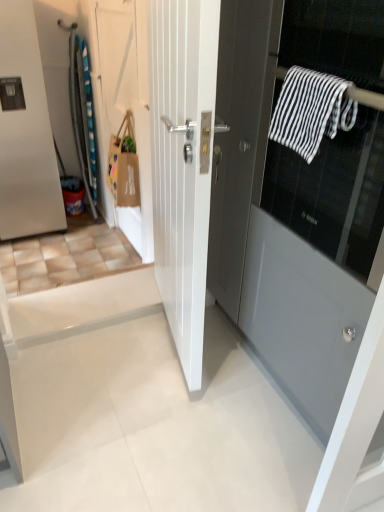
The width and height of the screenshot is (384, 512). Describe the element at coordinates (317, 214) in the screenshot. I see `matte gray door at center, the 4th door positioned from the left` at that location.

Image resolution: width=384 pixels, height=512 pixels. What do you see at coordinates (127, 102) in the screenshot?
I see `white matte door at upper left, placed as the 2th door when sorted from left to right` at bounding box center [127, 102].

This screenshot has height=512, width=384. What do you see at coordinates (311, 111) in the screenshot?
I see `black and white striped towel at upper right` at bounding box center [311, 111].

Measure the distance between point [208,206] and camera.

The depth of point [208,206] is 5.62 feet.

You are a GUI agent. You are given a task and a screenshot of the screen. Output one action in this format:
    pyautogui.click(x=<x>, y=<y>)
    Task: Click on the white glossy door at center, placed as the second door when sorted from right to left
    
    Given the screenshot: What is the action you would take?
    pyautogui.click(x=183, y=163)

This screenshot has width=384, height=512. Describe the element at coordinates (123, 167) in the screenshot. I see `brown paper bag at upper left` at that location.

Where is `satin silver refrigerator at left, which is the 4th door from right to left`? satin silver refrigerator at left, which is the 4th door from right to left is located at coordinates (26, 134).

Where is `matte gray door at center, the 4th door positioned from the left`? The height and width of the screenshot is (512, 384). matte gray door at center, the 4th door positioned from the left is located at coordinates (317, 214).

Could you tell me if matte gray door at center, which is the first door in right-to-left order, is facing white matte door at upper left, placed as the 2th door when sorted from left to right?

No, matte gray door at center, which is the first door in right-to-left order, is not aimed at white matte door at upper left, placed as the 2th door when sorted from left to right.

From a real-world perspective, is matte gray door at center, the 4th door positioned from the left, located higher than white matte door at upper left, placed as the 2th door when sorted from left to right?

Indeed, from a real-world perspective, matte gray door at center, the 4th door positioned from the left, stands above white matte door at upper left, placed as the 2th door when sorted from left to right.

Which object is closer to the camera taking this photo, matte gray door at center, which is the first door in right-to-left order, or white matte door at upper left, which appears as the 3th door when viewed from the right?

matte gray door at center, which is the first door in right-to-left order, is closer to the camera.

Can you confirm if matte gray door at center, the 4th door positioned from the left, is thinner than white matte door at upper left, which appears as the 3th door when viewed from the right?

No.

Is white glossy door at center, the 3th door from the left, thinner than black and white striped towel at upper right?

In fact, white glossy door at center, the 3th door from the left, might be wider than black and white striped towel at upper right.

From the image's perspective, which one is positioned higher, white glossy door at center, the 3th door from the left, or black and white striped towel at upper right?

black and white striped towel at upper right is shown above in the image.

Considering the relative positions of white glossy door at center, the 3th door from the left, and black and white striped towel at upper right in the image provided, is white glossy door at center, the 3th door from the left, to the left of black and white striped towel at upper right from the viewer's perspective?

Indeed, white glossy door at center, the 3th door from the left, is positioned on the left side of black and white striped towel at upper right.

Which is farther from the camera, (361, 109) or (125, 164)?

The point (125, 164) is farther from the camera.

Could you tell me if matte gray door at center, the 4th door positioned from the left, is facing brown paper bag at upper left?

No, matte gray door at center, the 4th door positioned from the left, is not aimed at brown paper bag at upper left.

Considering the relative sizes of matte gray door at center, which is the first door in right-to-left order, and brown paper bag at upper left in the image provided, is matte gray door at center, which is the first door in right-to-left order, taller than brown paper bag at upper left?

Indeed, matte gray door at center, which is the first door in right-to-left order, has a greater height compared to brown paper bag at upper left.

Measure the distance from matte gray door at center, the 4th door positioned from the left, to brown paper bag at upper left.

matte gray door at center, the 4th door positioned from the left, is 1.60 meters away from brown paper bag at upper left.

Does white glossy door at center, placed as the second door when sorted from right to left, have a greater width compared to brown paper bag at upper left?

Incorrect, the width of white glossy door at center, placed as the second door when sorted from right to left, does not surpass that of brown paper bag at upper left.

Considering the relative positions of white glossy door at center, the 3th door from the left, and brown paper bag at upper left in the image provided, is white glossy door at center, the 3th door from the left, to the right of brown paper bag at upper left from the viewer's perspective?

Correct, you'll find white glossy door at center, the 3th door from the left, to the right of brown paper bag at upper left.

From the image's perspective, which one is positioned lower, white glossy door at center, placed as the second door when sorted from right to left, or brown paper bag at upper left?

white glossy door at center, placed as the second door when sorted from right to left, is shown below in the image.

Based on the photo, would you say satin silver refrigerator at left, the first door when ordered from left to right, is inside or outside brown paper bag at upper left?

satin silver refrigerator at left, the first door when ordered from left to right, is located beyond the bounds of brown paper bag at upper left.

From a real-world perspective, is satin silver refrigerator at left, which is the 4th door from right to left, physically located above or below brown paper bag at upper left?

From a real-world perspective, satin silver refrigerator at left, which is the 4th door from right to left, is physically below brown paper bag at upper left.

Between satin silver refrigerator at left, the first door when ordered from left to right, and brown paper bag at upper left, which one has less height?

brown paper bag at upper left is shorter.

The width and height of the screenshot is (384, 512). Find the location of `shopping bag on the right side of satin silver refrigerator at left, which is the 4th door from right to left`. shopping bag on the right side of satin silver refrigerator at left, which is the 4th door from right to left is located at coordinates 123,167.

Find the location of a particular element. the 1st door in front when counting from the white matte door at upper left, placed as the 2th door when sorted from left to right is located at coordinates (183, 163).

Consider the image. Which object is further away from the camera, white matte door at upper left, placed as the 2th door when sorted from left to right, or white glossy door at center, the 3th door from the left?

white matte door at upper left, placed as the 2th door when sorted from left to right.

Does white matte door at upper left, placed as the 2th door when sorted from left to right, have a greater width compared to white glossy door at center, placed as the second door when sorted from right to left?

No.

From a real-world perspective, which is physically below, black and white striped towel at upper right or white glossy door at center, placed as the second door when sorted from right to left?

In real-world perspective, white glossy door at center, placed as the second door when sorted from right to left, is lower.

Considering the relative sizes of black and white striped towel at upper right and white glossy door at center, the 3th door from the left, in the image provided, is black and white striped towel at upper right smaller than white glossy door at center, the 3th door from the left,?

Yes, black and white striped towel at upper right is smaller than white glossy door at center, the 3th door from the left.

Is black and white striped towel at upper right situated inside white glossy door at center, placed as the second door when sorted from right to left, or outside?

black and white striped towel at upper right is spatially situated outside white glossy door at center, placed as the second door when sorted from right to left.

Could you tell me if black and white striped towel at upper right is turned towards white glossy door at center, placed as the second door when sorted from right to left?

No, black and white striped towel at upper right is not aimed at white glossy door at center, placed as the second door when sorted from right to left.

You are a GUI agent. You are given a task and a screenshot of the screen. Output one action in this format:
    pyautogui.click(x=<x>, y=<y>)
    Task: Click on the 2nd door behind the matte gray door at center, which is the first door in right-to-left order
    
    Given the screenshot: What is the action you would take?
    pyautogui.click(x=127, y=102)

From a real-world perspective, count 1st doors downward from the black and white striped towel at upper right and point to it. Please provide its 2D coordinates.

[(183, 163)]

From the image, which object appears to be nearer to black and white striped towel at upper right, brown paper bag at upper left or satin silver refrigerator at left, which is the 4th door from right to left?

The object closer to black and white striped towel at upper right is brown paper bag at upper left.

From the image, which object appears to be farther from satin silver refrigerator at left, the first door when ordered from left to right, black and white striped towel at upper right or brown paper bag at upper left?

black and white striped towel at upper right is positioned further to the anchor satin silver refrigerator at left, the first door when ordered from left to right.

From the image, which object appears to be nearer to white matte door at upper left, which appears as the 3th door when viewed from the right, matte gray door at center, the 4th door positioned from the left, or white glossy door at center, the 3th door from the left?

The object closer to white matte door at upper left, which appears as the 3th door when viewed from the right, is white glossy door at center, the 3th door from the left.

Based on their spatial positions, is black and white striped towel at upper right or white matte door at upper left, which appears as the 3th door when viewed from the right, closer to white glossy door at center, the 3th door from the left?

The object closer to white glossy door at center, the 3th door from the left, is black and white striped towel at upper right.

When comparing their distances from black and white striped towel at upper right, does matte gray door at center, which is the first door in right-to-left order, or brown paper bag at upper left seem further?

Among the two, brown paper bag at upper left is located further to black and white striped towel at upper right.

When comparing their distances from white glossy door at center, the 3th door from the left, does brown paper bag at upper left or matte gray door at center, which is the first door in right-to-left order, seem further?

brown paper bag at upper left.

When comparing their distances from black and white striped towel at upper right, does brown paper bag at upper left or white glossy door at center, placed as the second door when sorted from right to left, seem closer?

Based on the image, white glossy door at center, placed as the second door when sorted from right to left, appears to be nearer to black and white striped towel at upper right.

From the image, which object appears to be farther from satin silver refrigerator at left, the first door when ordered from left to right, white matte door at upper left, which appears as the 3th door when viewed from the right, or black and white striped towel at upper right?

The object further to satin silver refrigerator at left, the first door when ordered from left to right, is black and white striped towel at upper right.

This screenshot has height=512, width=384. What are the coordinates of `door positioned between matte gray door at center, which is the first door in right-to-left order, and white matte door at upper left, placed as the 2th door when sorted from left to right, from near to far` in the screenshot? It's located at (183, 163).

At what (x,y) coordinates should I click in order to perform the action: click on bath towel located between white glossy door at center, the 3th door from the left, and white matte door at upper left, placed as the 2th door when sorted from left to right, in the depth direction. Please return your answer as a coordinate pair (x, y). The width and height of the screenshot is (384, 512). Looking at the image, I should click on (311, 111).

At what (x,y) coordinates should I click in order to perform the action: click on bath towel located between satin silver refrigerator at left, which is the 4th door from right to left, and matte gray door at center, the 4th door positioned from the left, in the left-right direction. Please return your answer as a coordinate pair (x, y). The image size is (384, 512). Looking at the image, I should click on (311, 111).

Find the location of `shopping bag between matte gray door at center, which is the first door in right-to-left order, and satin silver refrigerator at left, which is the 4th door from right to left, from front to back`. shopping bag between matte gray door at center, which is the first door in right-to-left order, and satin silver refrigerator at left, which is the 4th door from right to left, from front to back is located at coordinates (123, 167).